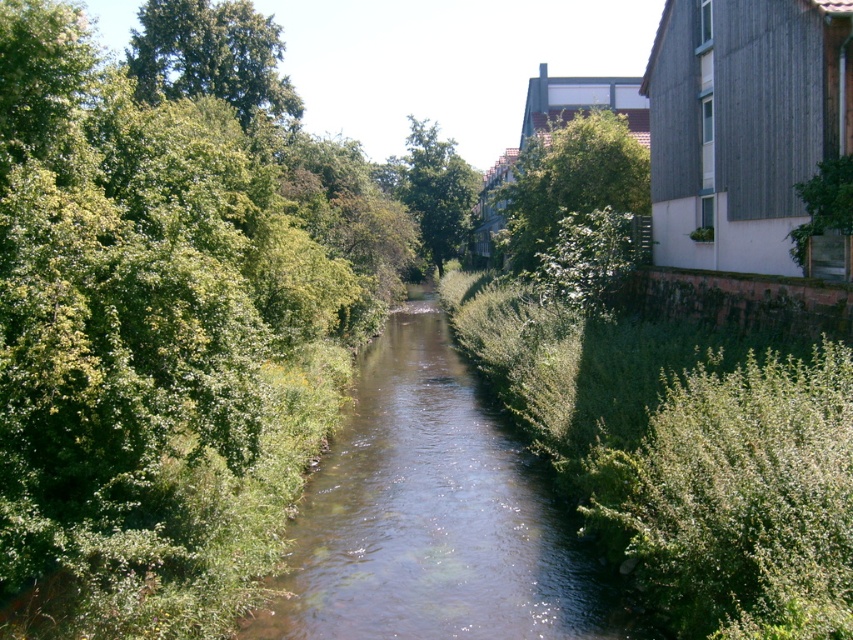
You are a landscape architect planning to plant a new tree between the green leafy tree at left and the green leafy tree at upper center. The new tree requires a minimum spacing of 10 meters between existing trees. Based on the scene, is the current distance sufficient for planting the new tree?

The distance between the green leafy tree at left and the green leafy tree at upper center is 10.42 meters. Since the required minimum spacing is 10 meters, the current distance is sufficient for planting the new tree.

You are standing at the center of the waterway and looking towards the residential buildings. Which of the two green leafy trees, the green leafy tree at left or the green leafy tree at upper center, is closer to you?

The green leafy tree at left is closer to you because it is positioned below the green leafy tree at upper center, indicating it is nearer in the scene.

You are standing at the entrance of the waterway and want to see both the green leafy tree at upper left and the green leafy tree at right. Which tree will appear closer to you?

A: The green leafy tree at upper left will appear closer to you because it is further to the viewer than the green leafy tree at right.